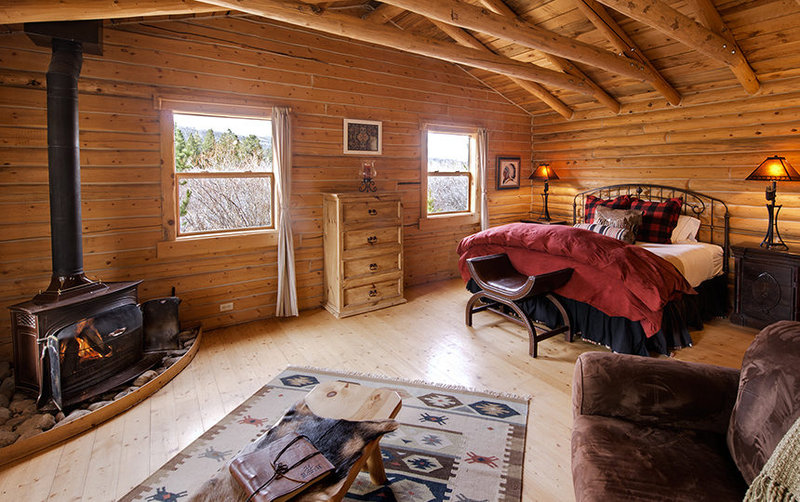
Where is `fireplace`? Image resolution: width=800 pixels, height=502 pixels. fireplace is located at coordinates click(x=89, y=332).